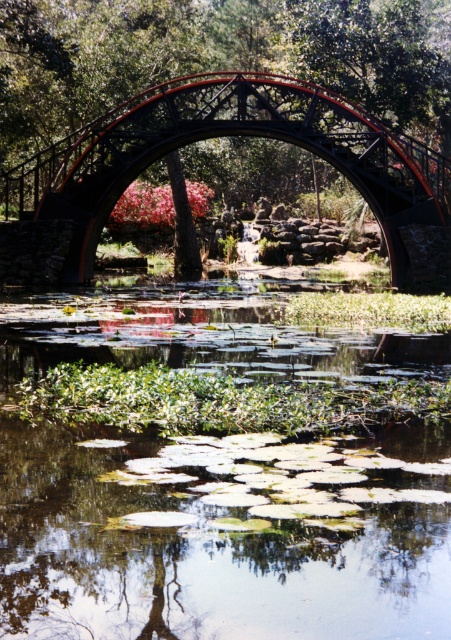
You are a landscape architect reviewing this scene. You need to determine if the green leafy water at center has more area coverage than the black metal bridge at center. Based on the provided information, what is your conclusion?

The green leafy water at center occupies less space than the black metal bridge at center, so it does not have more area coverage.